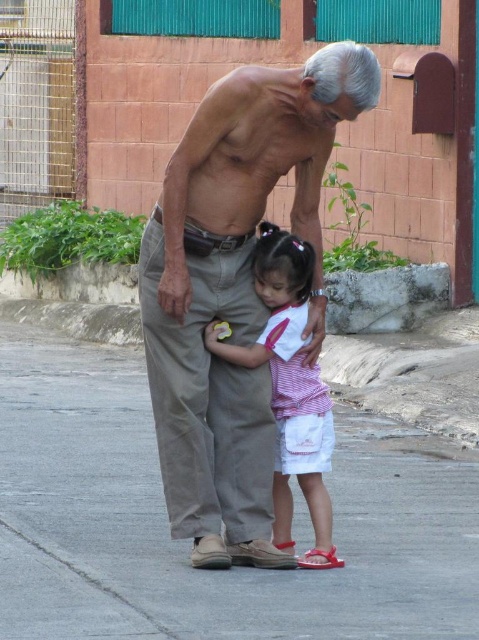
Does tan cotton pants at center appear on the left side of striped cotton shirt at center?

Correct, you'll find tan cotton pants at center to the left of striped cotton shirt at center.

Which is in front, point (180, 516) or point (278, 477)?

Point (180, 516) is more forward.

Where is `tan cotton pants at center`? tan cotton pants at center is located at coordinates (235, 289).

Does gray concrete pavement at center have a lesser height compared to striped cotton shirt at center?

Correct, gray concrete pavement at center is not as tall as striped cotton shirt at center.

Locate an element on the screen. Image resolution: width=479 pixels, height=640 pixels. gray concrete pavement at center is located at coordinates (186, 545).

Between point (102, 524) and point (219, 440), which one is positioned in front?

Point (219, 440) is more forward.

Does gray concrete pavement at center have a lesser height compared to tan cotton pants at center?

Yes, gray concrete pavement at center is shorter than tan cotton pants at center.

From the picture: Who is more forward, (357, 536) or (249, 317)?

Point (249, 317)

Find the location of a particular element. gray concrete pavement at center is located at coordinates (186, 545).